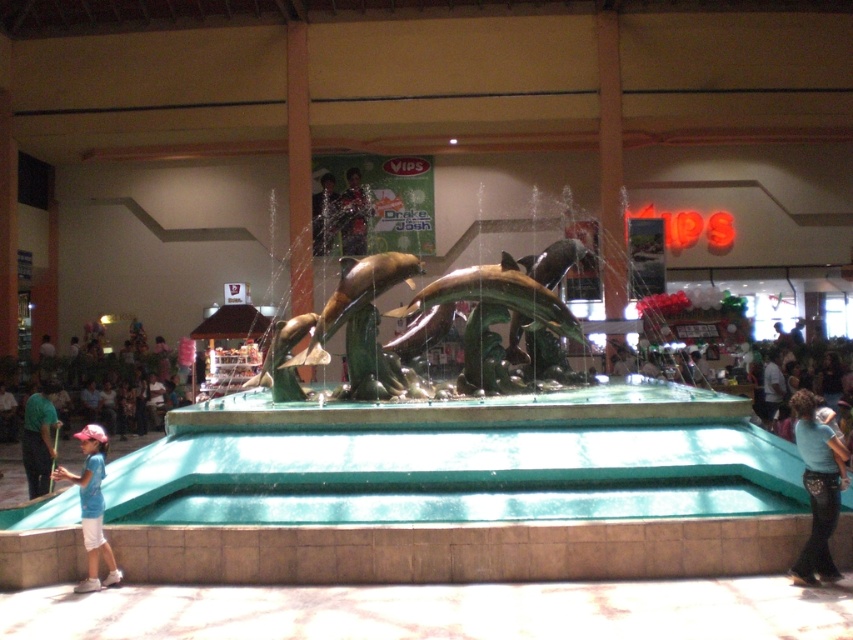
Question: Can you confirm if blue denim jeans at lower right is wider than green fabric shirt at left?

Choices:
 (A) no
 (B) yes

Answer: (A)

Question: Which object appears closest to the camera in this image?

Choices:
 (A) green fabric shirt at left
 (B) blue denim jeans at lower right

Answer: (B)

Question: Which point is farther from the camera taking this photo?

Choices:
 (A) (42, 384)
 (B) (96, 536)

Answer: (A)

Question: Based on their relative distances, which object is farther from the green fabric shirt at left?

Choices:
 (A) blue denim jeans at lower right
 (B) blue cotton shirt at lower left

Answer: (A)

Question: Is blue cotton shirt at lower left thinner than green fabric shirt at left?

Choices:
 (A) no
 (B) yes

Answer: (A)

Question: Is blue denim jeans at lower right to the right of green fabric shirt at left from the viewer's perspective?

Choices:
 (A) yes
 (B) no

Answer: (A)